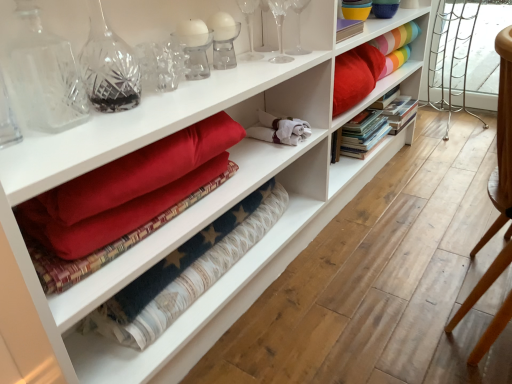
You are a GUI agent. You are given a task and a screenshot of the screen. Output one action in this format:
    pyautogui.click(x=<x>, y=<y>)
    Task: Click on the free space below white textured fabric at center (from a real-world perspective)
    This screenshot has width=512, height=384.
    Given the screenshot: What is the action you would take?
    pyautogui.click(x=226, y=314)